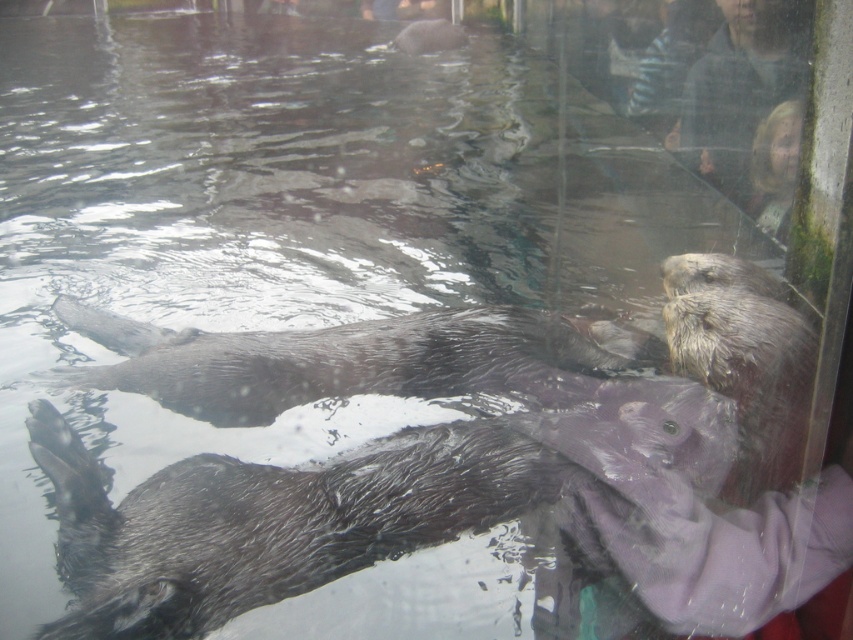
Question: Which point is farther to the camera?

Choices:
 (A) (149, 356)
 (B) (398, 524)

Answer: (A)

Question: Where is wet fur otter at lower left located in relation to shiny brown otter at center in the image?

Choices:
 (A) right
 (B) left

Answer: (A)

Question: Does wet fur otter at lower left appear over shiny brown otter at center?

Choices:
 (A) yes
 (B) no

Answer: (B)

Question: Among these points, which one is nearest to the camera?

Choices:
 (A) (537, 497)
 (B) (462, 340)

Answer: (A)

Question: Is wet fur otter at lower left below shiny brown otter at center?

Choices:
 (A) no
 (B) yes

Answer: (B)